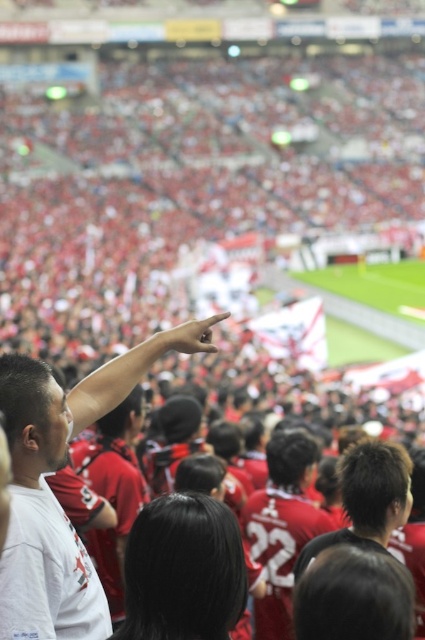
You are a photographer trying to capture a photo of the dark brown hair at center without the red jersey at left blocking it. Where should you move relative to the current position?

Move to the right side of the dark brown hair at center so that the red jersey at left is no longer blocking the view.

You are standing in the stadium and see two points marked in the image. Which point is closer to you, point (98, 582) or point (354, 518)?

Point (98, 582) is closer to the viewer than point (354, 518).

You are standing at the center of the stadium field. You see a point marked at coordinates (53, 493). What object is located at that point?

The point at coordinates (53, 493) corresponds to the red jersey at left.